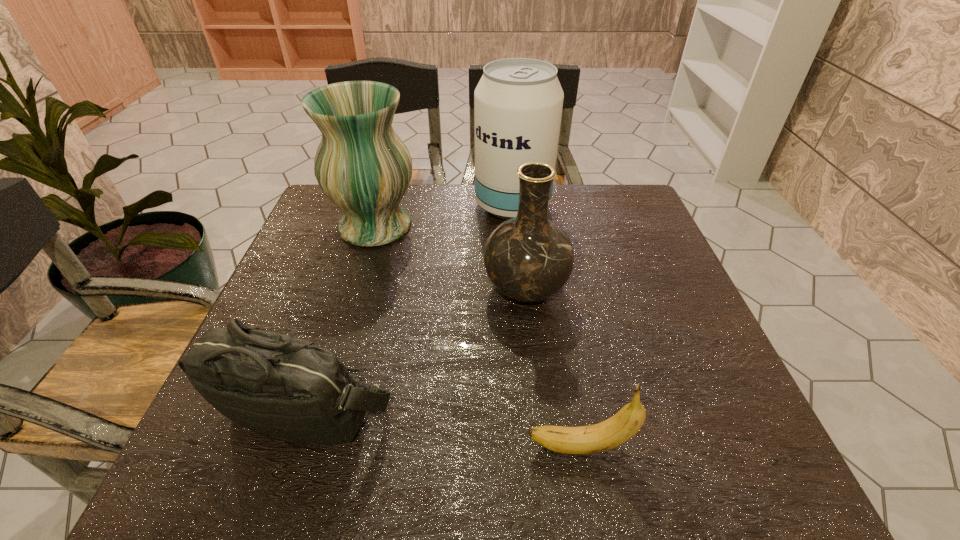
Where is `alcohol`? This screenshot has width=960, height=540. alcohol is located at coordinates (518, 102).

At what (x,y) coordinates should I click in order to perform the action: click on the farther vase. Please return your answer as a coordinate pair (x, y). Looking at the image, I should click on (361, 164).

Image resolution: width=960 pixels, height=540 pixels. I want to click on the right vase, so click(528, 258).

The width and height of the screenshot is (960, 540). In order to click on the third nearest object in this screenshot , I will do `click(528, 258)`.

Where is `shoulder bag`? Image resolution: width=960 pixels, height=540 pixels. shoulder bag is located at coordinates (284, 386).

The image size is (960, 540). I want to click on banana, so click(608, 434).

This screenshot has width=960, height=540. I want to click on free space located on the right of the alcohol, so click(x=631, y=205).

The height and width of the screenshot is (540, 960). Find the location of `blank space located 0.340m on the front of the left vase`. blank space located 0.340m on the front of the left vase is located at coordinates (335, 360).

I want to click on vacant space located on the left of the third farthest object, so click(x=318, y=289).

You are a GUI agent. You are given a task and a screenshot of the screen. Output one action in this format:
    pyautogui.click(x=<x>, y=<y>)
    Task: Click on the blank area located 0.290m at the start of the peel on the shortest object
    
    Given the screenshot: What is the action you would take?
    pyautogui.click(x=357, y=447)